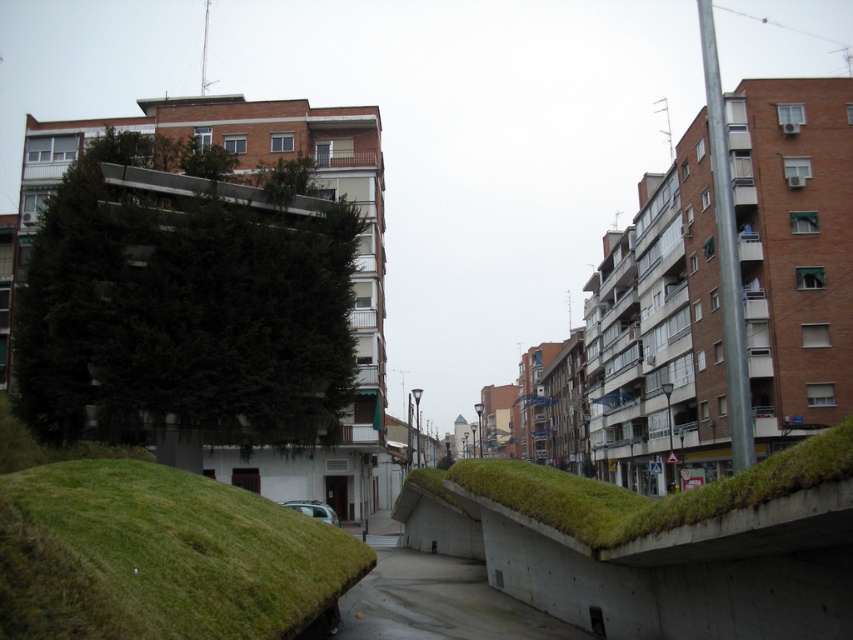
You are a delivery drone flying over an urban area with a narrow pedestrian pathway between two modern buildings. You need to land on the green grassy mound at center. Based on the coordinates provided, can you confirm if the mound is within the designated landing zone at point 0.869, 0.186?

The green grassy mound at center is located exactly at point (158, 556), so it is within the designated landing zone.

You are a delivery person carrying a heavy package and need to walk along the pathway. The pathway has a green grassy mound at center and concrete at center. Which surface should you choose to walk on to ensure stability?

You should choose the concrete at center because the green grassy mound at center has a lesser width compared to concrete at center, making the concrete a wider and more stable surface for walking.

You are a delivery person standing at the edge of the pathway and need to deliver a package to the silver metallic car at center. The concrete at center is in your way. Can you walk around it? Explain your reasoning.

The concrete at center is closer to the viewer than the silver metallic car at center, so you can walk around the concrete at center to reach the silver metallic car at center since it is positioned behind it.